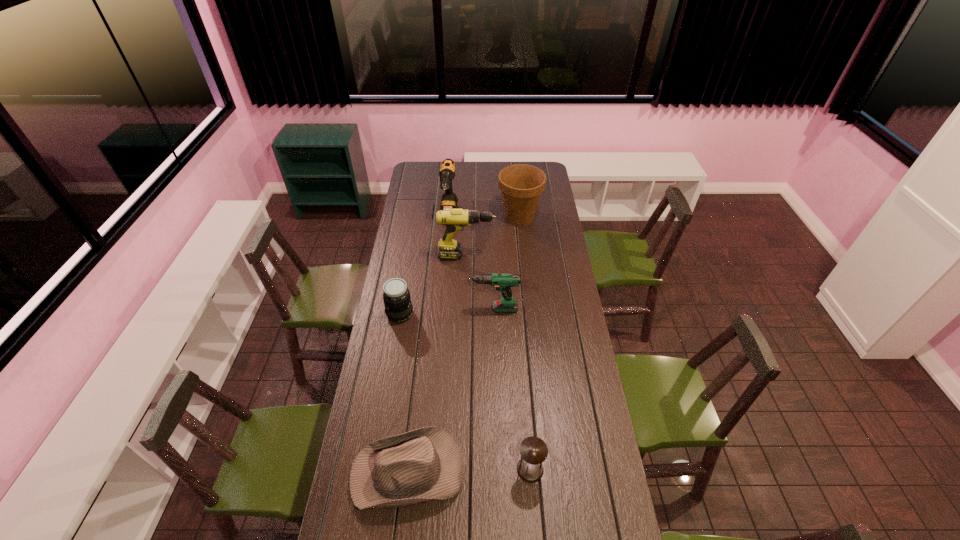
Where is `vacant area located on the left of the flowerpot`? The height and width of the screenshot is (540, 960). vacant area located on the left of the flowerpot is located at coordinates (442, 217).

Locate an element on the screen. The width and height of the screenshot is (960, 540). vacant space located 0.280m on the handle side of the shortest drill is located at coordinates (402, 309).

Where is `vacant space located on the handle side of the shortest drill`? vacant space located on the handle side of the shortest drill is located at coordinates (385, 309).

The width and height of the screenshot is (960, 540). Find the location of `vacant space located 0.360m on the handle side of the shortest drill`. vacant space located 0.360m on the handle side of the shortest drill is located at coordinates (385, 309).

The image size is (960, 540). I want to click on vacant area located 0.190m on the front of the telephoto lens, so tap(392, 360).

This screenshot has height=540, width=960. I want to click on vacant space located on the back of the hourglass, so click(526, 422).

Identify the location of free space located on the right of the fedora. The width and height of the screenshot is (960, 540). (505, 470).

At what (x,y) coordinates should I click in order to perform the action: click on telephoto lens present at the left edge. Please return your answer as a coordinate pair (x, y). Looking at the image, I should click on (398, 307).

Locate an element on the screen. This screenshot has height=540, width=960. fedora positioned at the left edge is located at coordinates (415, 467).

Locate an element on the screen. This screenshot has width=960, height=540. object at the right edge is located at coordinates (521, 185).